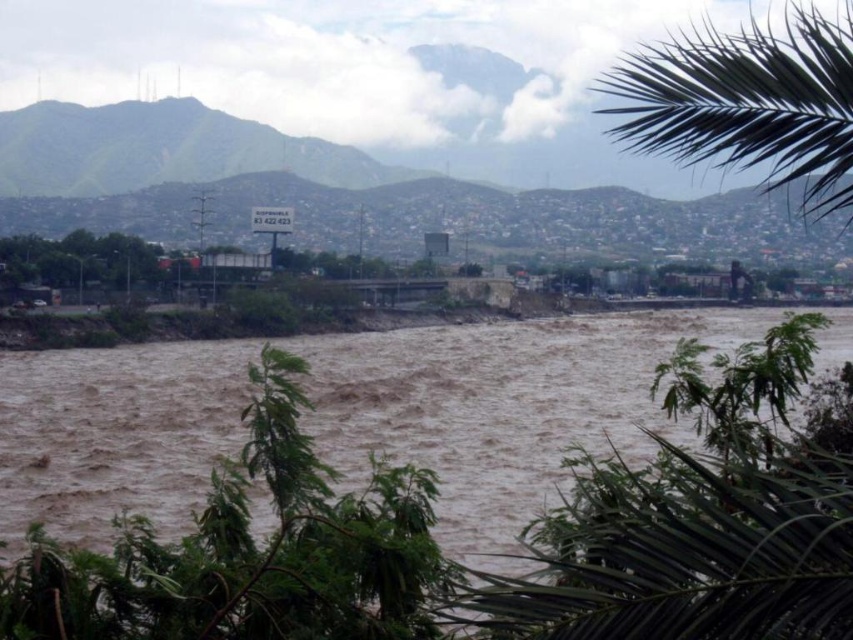
Question: Which point is farther to the camera?

Choices:
 (A) (53, 179)
 (B) (724, 97)
 (C) (113, 586)

Answer: (A)

Question: Does brown muddy water at center have a smaller size compared to green leafy palm at upper right?

Choices:
 (A) yes
 (B) no

Answer: (A)

Question: Among these objects, which one is nearest to the camera?

Choices:
 (A) green leafy palm at upper right
 (B) brown muddy water at center
 (C) green leafy mountain at upper left

Answer: (B)

Question: Can you confirm if green leafy palm at upper right is bigger than green leafy mountain at upper left?

Choices:
 (A) no
 (B) yes

Answer: (B)

Question: Observing the image, what is the correct spatial positioning of green leafy palm at upper right in reference to green leafy mountain at upper left?

Choices:
 (A) below
 (B) above

Answer: (A)

Question: Which point appears closest to the camera in this image?

Choices:
 (A) (584, 595)
 (B) (845, 56)
 (C) (161, 132)

Answer: (A)